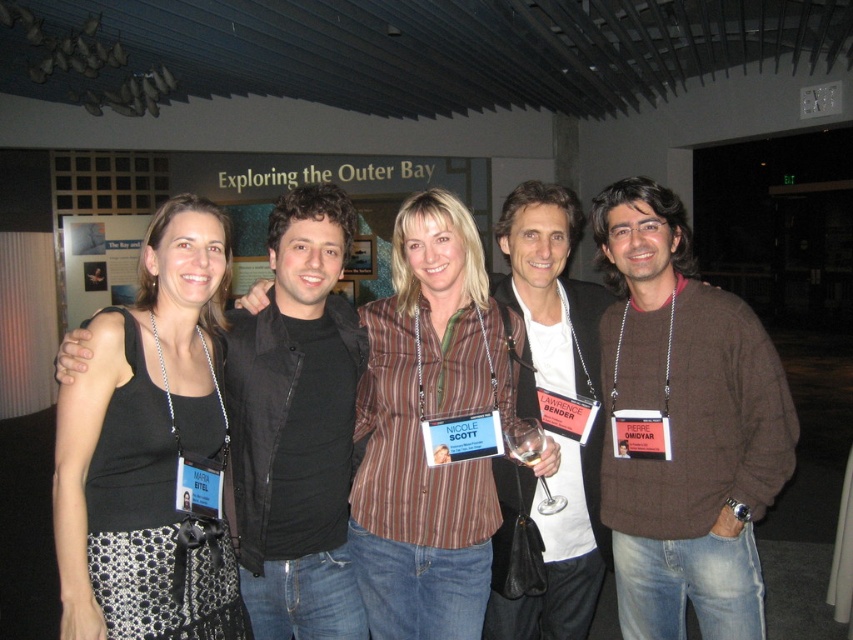
Does brown sweater at right come behind brown sweater at center?

No, it is not.

Which of these two, brown sweater at right or brown sweater at center, stands shorter?

brown sweater at right is shorter.

Locate an element on the screen. This screenshot has width=853, height=640. brown sweater at right is located at coordinates (683, 426).

Who is positioned more to the right, brown sweater at right or black textured tank top at left?

From the viewer's perspective, brown sweater at right appears more on the right side.

Is point (643, 442) behind point (190, 344)?

That is True.

Where is `brown sweater at right`? brown sweater at right is located at coordinates click(683, 426).

Who is positioned more to the right, brown striped shirt at center or brown sweater at center?

brown sweater at center is more to the right.

Which is behind, point (398, 508) or point (547, 356)?

The point (547, 356) is more distant.

Is point (422, 253) farther from viewer compared to point (572, 598)?

No, (422, 253) is closer to viewer.

At what (x,y) coordinates should I click in order to perform the action: click on brown striped shirt at center. Please return your answer as a coordinate pair (x, y). Looking at the image, I should click on (427, 428).